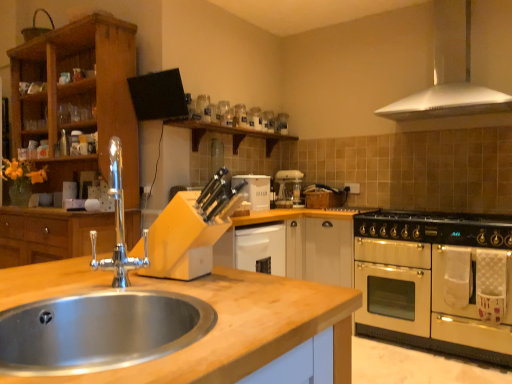
The height and width of the screenshot is (384, 512). Describe the element at coordinates (437, 228) in the screenshot. I see `black matte gas stove at right` at that location.

Describe the element at coordinates (79, 96) in the screenshot. I see `wooden cabinet at left` at that location.

What do you see at coordinates (118, 226) in the screenshot? I see `polished chrome faucet at sink left` at bounding box center [118, 226].

Where is `white plastic coffee machine at center`? white plastic coffee machine at center is located at coordinates (289, 188).

How different are the orientations of black matte gas stove at right and stainless steel sink at lower left in degrees?

The angular difference between black matte gas stove at right and stainless steel sink at lower left is 89.6 degrees.

Between point (421, 218) and point (85, 362), which one is positioned behind?

Positioned behind is point (421, 218).

What are the coordinates of `sink above the black matte gas stove at right (from a real-world perspective)` in the screenshot? It's located at [x=99, y=331].

Is black matte gas stove at right bigger than stainless steel sink at lower left?

Indeed, black matte gas stove at right has a larger size compared to stainless steel sink at lower left.

Who is more distant, white metallic exhaust hood at upper right or white matte bread bin at center?

white matte bread bin at center is behind.

Is white metallic exhaust hood at upper right directly adjacent to white matte bread bin at center?

white metallic exhaust hood at upper right and white matte bread bin at center are not in contact.

Is white metallic exhaust hood at upper right thinner than white matte bread bin at center?

No, white metallic exhaust hood at upper right is not thinner than white matte bread bin at center.

Is white metallic exhaust hood at upper right looking in the opposite direction of white matte bread bin at center?

white metallic exhaust hood at upper right does not have its back to white matte bread bin at center.

Are black matte gas stove at right and white metallic exhaust hood at upper right making contact?

No, black matte gas stove at right is not beside white metallic exhaust hood at upper right.

Which object is closer to the camera, black matte gas stove at right or white metallic exhaust hood at upper right?

black matte gas stove at right is more forward.

Considering the relative positions of black matte gas stove at right and white metallic exhaust hood at upper right in the image provided, is black matte gas stove at right to the right of white metallic exhaust hood at upper right from the viewer's perspective?

Incorrect, black matte gas stove at right is not on the right side of white metallic exhaust hood at upper right.

From the picture: Is white matte bread bin at center further to the viewer compared to polished chrome faucet at sink left?

Yes, white matte bread bin at center is further from the viewer.

Looking at this image, how many degrees apart are the facing directions of white matte bread bin at center and polished chrome faucet at sink left?

The angular difference between white matte bread bin at center and polished chrome faucet at sink left is 52.3 degrees.

Considering the positions of objects white matte bread bin at center and polished chrome faucet at sink left in the image provided, who is more to the right, white matte bread bin at center or polished chrome faucet at sink left?

white matte bread bin at center.

Is point (73, 340) positioned before point (439, 108)?

Yes, point (73, 340) is in front of point (439, 108).

Looking at the image, does stainless steel sink at lower left seem bigger or smaller compared to white metallic exhaust hood at upper right?

Clearly, stainless steel sink at lower left is smaller in size than white metallic exhaust hood at upper right.

Is stainless steel sink at lower left far from white metallic exhaust hood at upper right?

stainless steel sink at lower left is positioned a significant distance from white metallic exhaust hood at upper right.

How far apart are stainless steel sink at lower left and white metallic exhaust hood at upper right?

The distance of stainless steel sink at lower left from white metallic exhaust hood at upper right is 9.36 feet.

Is white matte bread bin at center in front of or behind wooden cabinet at left in the image?

Visually, white matte bread bin at center is located behind wooden cabinet at left.

From a real-world perspective, is white matte bread bin at center below wooden cabinet at left?

Correct, in the physical world, white matte bread bin at center is lower than wooden cabinet at left.

Is white matte bread bin at center looking in the opposite direction of wooden cabinet at left?

That's not correct — white matte bread bin at center is not looking away from wooden cabinet at left.

Is stainless steel sink at lower left taller or shorter than polished chrome faucet at sink left?

In the image, stainless steel sink at lower left appears to be shorter than polished chrome faucet at sink left.

From the picture: Is stainless steel sink at lower left not near polished chrome faucet at sink left?

Yes, stainless steel sink at lower left is far from polished chrome faucet at sink left.

Does stainless steel sink at lower left appear on the right side of polished chrome faucet at sink left?

Yes.

Where is `gas stove on the right of stainless steel sink at lower left`? gas stove on the right of stainless steel sink at lower left is located at coordinates (437, 228).

Identify the location of exhaust hood that is above the white matte bread bin at center (from the image's perspective). This screenshot has height=384, width=512. (450, 73).

Considering their positions, is stainless steel sink at lower left positioned further to white metallic exhaust hood at upper right than black matte gas stove at right?

Based on the image, stainless steel sink at lower left appears to be further to white metallic exhaust hood at upper right.

Based on their spatial positions, is white plastic coffee machine at center or polished chrome faucet at sink left closer to stainless steel sink at lower left?

polished chrome faucet at sink left lies closer to stainless steel sink at lower left than the other object.

Looking at the image, which one is located closer to white metallic exhaust hood at upper right, cream matte oven at right or polished chrome faucet at sink left?

cream matte oven at right.

When comparing their distances from white metallic exhaust hood at upper right, does white plastic coffee machine at center or black matte gas stove at right seem further?

white plastic coffee machine at center lies further to white metallic exhaust hood at upper right than the other object.

Estimate the real-world distances between objects in this image. Which object is further from cream matte oven at right, polished chrome faucet at sink left or wooden cabinet at left?

The object further to cream matte oven at right is wooden cabinet at left.

When comparing their distances from black matte gas stove at right, does polished chrome faucet at sink left or white metallic exhaust hood at upper right seem closer?

white metallic exhaust hood at upper right is positioned closer to the anchor black matte gas stove at right.

When comparing their distances from stainless steel sink at lower left, does white plastic coffee machine at center or black matte gas stove at right seem closer?

black matte gas stove at right lies closer to stainless steel sink at lower left than the other object.

Which object lies further to the anchor point stainless steel sink at lower left, cream matte oven at right or polished chrome faucet at sink left?

cream matte oven at right is positioned further to the anchor stainless steel sink at lower left.

The width and height of the screenshot is (512, 384). I want to click on tap positioned between stainless steel sink at lower left and wooden cabinet at left from near to far, so click(118, 226).

Locate an element on the screen. The image size is (512, 384). oven between stainless steel sink at lower left and white metallic exhaust hood at upper right along the z-axis is located at coordinates (419, 304).

In order to click on cabinetry between polished chrome faucet at sink left and white matte bread bin at center in the front-back direction in this screenshot , I will do coord(79,96).

Where is `exhaust hood between stainless steel sink at lower left and white matte bread bin at center along the z-axis`? The width and height of the screenshot is (512, 384). exhaust hood between stainless steel sink at lower left and white matte bread bin at center along the z-axis is located at coordinates (450, 73).